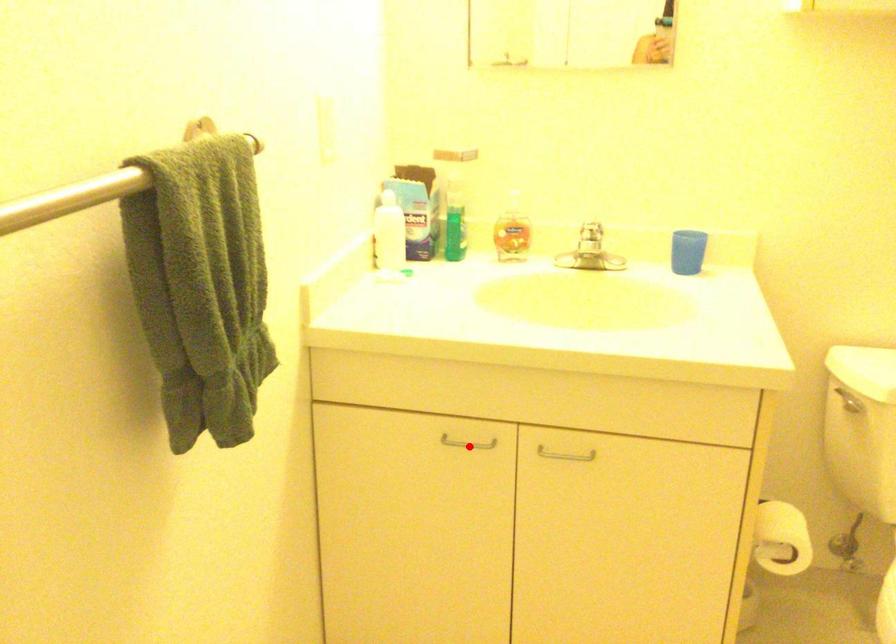
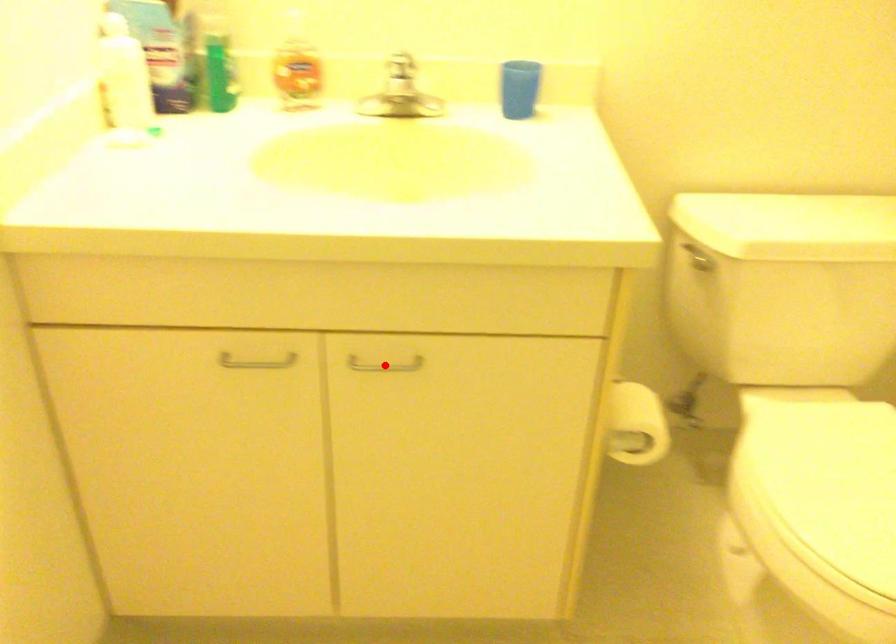
I am providing you with two images of the same scene from different viewpoints. A red point is marked on the first image and another point is marked on the second image. Are the points marked in image1 and image2 representing the same 3D position?

No